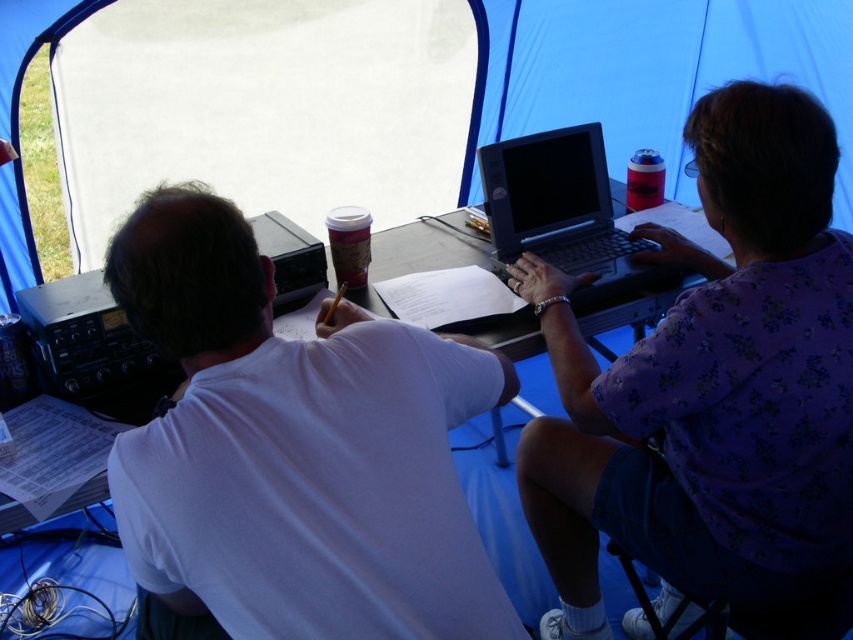
You are a photographer taking a picture of the scene. You need to ensure that both the purple floral shirt at center and the matte plastic cup at upper right are clearly visible in the frame. Based on their sizes, which object should you focus on first to ensure proper focus?

The purple floral shirt at center is taller than the matte plastic cup at upper right, so you should focus on the purple floral shirt at center first because larger objects often require more precise focus to ensure clarity.

You are organizing a picnic and need to place the purple floral shirt at center and the matte plastic cup at upper right on a small table. Which object should you place first to ensure there is enough space for both?

The purple floral shirt at center is wider than the matte plastic cup at upper right, so you should place the purple floral shirt at center first to ensure there is enough space for both.